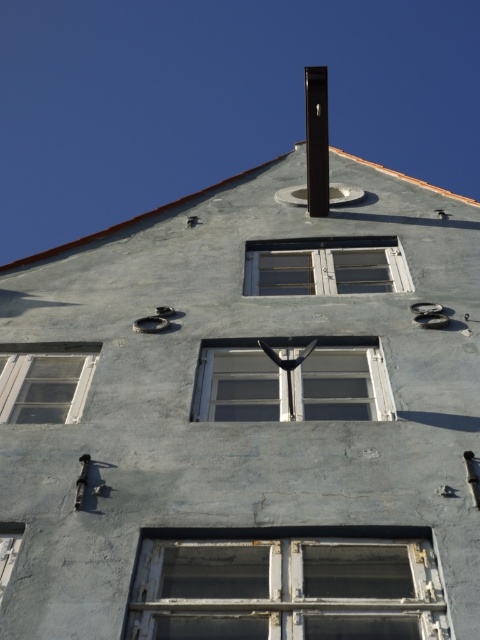
Question: Which of the following is the farthest from the observer?

Choices:
 (A) white wooden window at center
 (B) rusty metal window at lower center
 (C) white plastic window at center

Answer: (A)

Question: Among these objects, which one is nearest to the camera?

Choices:
 (A) black matte pole at upper center
 (B) white plastic window at center
 (C) white wooden window at lower left
 (D) white wooden window at center

Answer: (C)

Question: Can you confirm if rusty metal window at lower center is positioned to the left of transparent glass window at left?

Choices:
 (A) yes
 (B) no

Answer: (B)

Question: Which point is farther from the camera taking this photo?

Choices:
 (A) (321, 92)
 (B) (286, 355)
 (C) (40, 392)
 (D) (307, 280)

Answer: (A)

Question: Where is rusty metal window at lower center located in relation to transparent glass window at left in the image?

Choices:
 (A) right
 (B) left

Answer: (A)

Question: Is white wooden window at center to the left of white wooden window at lower left from the viewer's perspective?

Choices:
 (A) no
 (B) yes

Answer: (A)